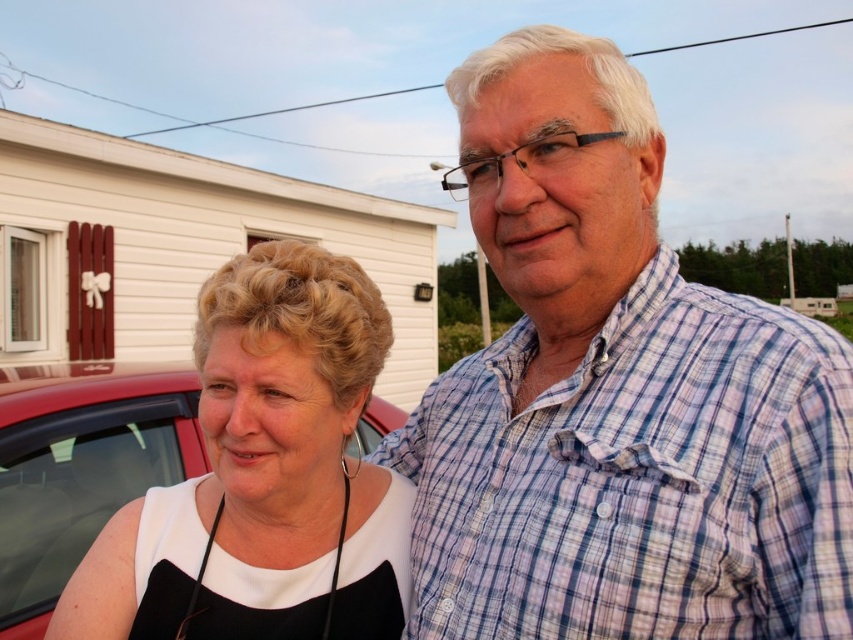
You are standing in front of the small single story house with white siding and a red door. You need to reach a point at coordinate point (x=543, y=515). If your arm is 36 inches long, can you reach that point without moving your feet?

The distance of point (x=543, y=515) from viewer is 36.40 inches, so no, you cannot reach the point as your arm is 36 inches and the point is slightly further away.